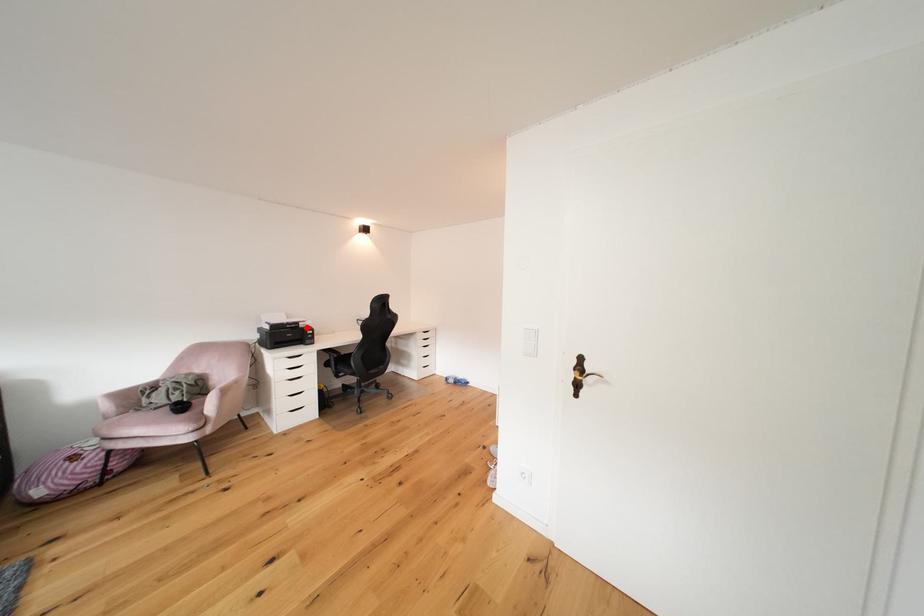
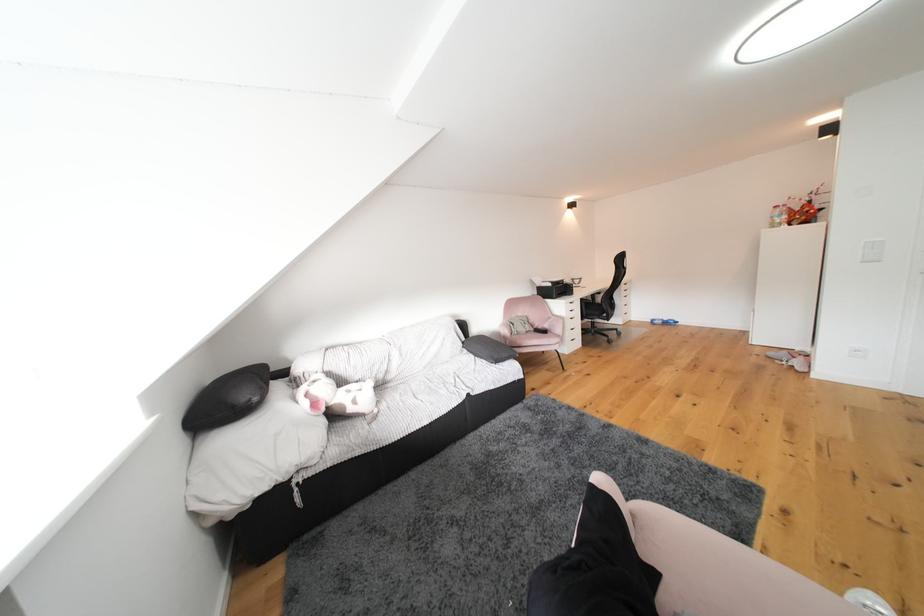
Where in the second image is the point corresponding to the highlighted location from the first image?

(572, 285)